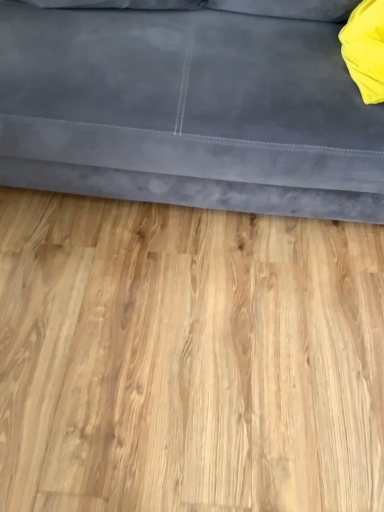
Question: Is yellow fabric pillow at upper right a part of suede gray couch at upper center?

Choices:
 (A) no
 (B) yes

Answer: (B)

Question: Does suede gray couch at upper center have a larger size compared to yellow fabric pillow at upper right?

Choices:
 (A) no
 (B) yes

Answer: (B)

Question: From the image's perspective, is suede gray couch at upper center over yellow fabric pillow at upper right?

Choices:
 (A) no
 (B) yes

Answer: (B)

Question: Is the depth of suede gray couch at upper center greater than that of yellow fabric pillow at upper right?

Choices:
 (A) no
 (B) yes

Answer: (A)

Question: From the image's perspective, is suede gray couch at upper center located beneath yellow fabric pillow at upper right?

Choices:
 (A) yes
 (B) no

Answer: (B)

Question: From a real-world perspective, is suede gray couch at upper center above or below yellow fabric pillow at upper right?

Choices:
 (A) below
 (B) above

Answer: (A)

Question: Looking at the image, does suede gray couch at upper center seem bigger or smaller compared to yellow fabric pillow at upper right?

Choices:
 (A) small
 (B) big

Answer: (B)

Question: In terms of width, does suede gray couch at upper center look wider or thinner when compared to yellow fabric pillow at upper right?

Choices:
 (A) thin
 (B) wide

Answer: (B)

Question: Is point (223, 106) closer or farther from the camera than point (344, 39)?

Choices:
 (A) closer
 (B) farther

Answer: (A)

Question: From the image's perspective, relative to suede gray couch at upper center, is yellow fabric pillow at upper right above or below?

Choices:
 (A) below
 (B) above

Answer: (A)

Question: Considering the positions of point (377, 26) and point (228, 100), is point (377, 26) closer or farther from the camera than point (228, 100)?

Choices:
 (A) farther
 (B) closer

Answer: (A)

Question: Considering their positions, is yellow fabric pillow at upper right located in front of or behind suede gray couch at upper center?

Choices:
 (A) front
 (B) behind

Answer: (B)

Question: Is yellow fabric pillow at upper right situated inside suede gray couch at upper center or outside?

Choices:
 (A) outside
 (B) inside

Answer: (B)

Question: From the image's perspective, relative to light wood flooring at center, is yellow fabric pillow at upper right above or below?

Choices:
 (A) below
 (B) above

Answer: (B)

Question: From a real-world perspective, is yellow fabric pillow at upper right above or below light wood flooring at center?

Choices:
 (A) above
 (B) below

Answer: (A)